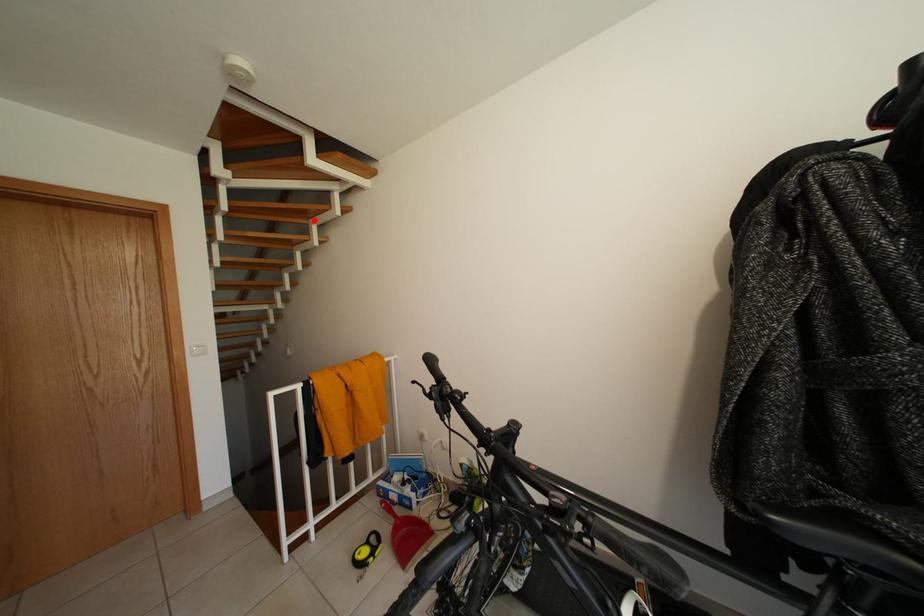
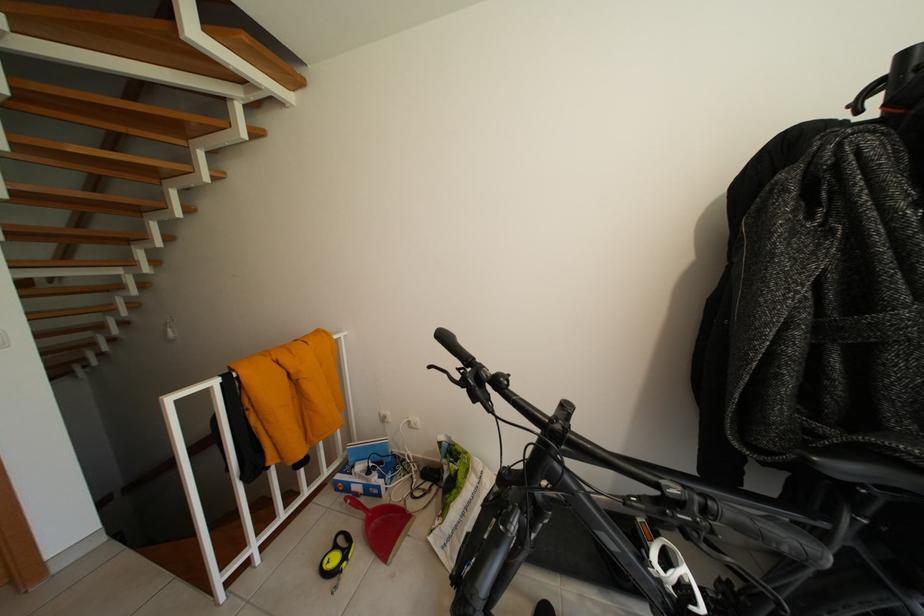
The point at the highlighted location is marked in the first image. Where is the corresponding point in the second image?

(190, 137)